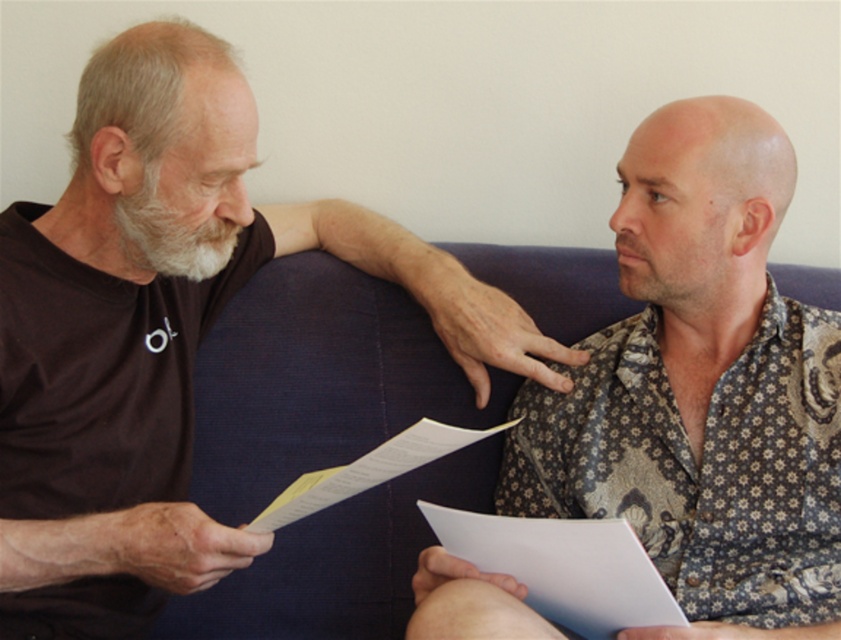
You are an interior designer assessing the living room layout. The brown cotton shirt at left is worn by a person sitting on a couch. You need to place a decorative item on the coffee table that is smaller than the white paper at center. Which object should you choose?

The brown cotton shirt at left is larger in size than the white paper at center, so the white paper at center is the smaller object. Therefore, you should choose the white paper at center as the decorative item since it is smaller than the white paper at center.

You are standing in the room and want to place a 3.5 feet wide painting on the wall. The painting must be centered at point (707,240). Is there enough space between you and the wall to safely hang the painting?

The distance between you and the wall at point (707,240) is 4.15 feet. Since the painting is 3.5 feet wide, there is enough space to safely hang it as the distance is greater than the painting width.